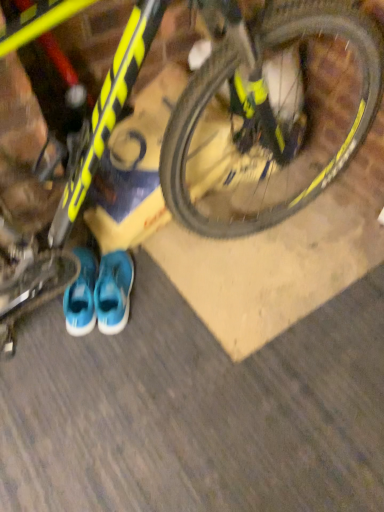
This screenshot has height=512, width=384. Find the location of `empty space that is ontop of yellow matte bicycle at upper center (from a real-world perspective)`. empty space that is ontop of yellow matte bicycle at upper center (from a real-world perspective) is located at coordinates (221, 348).